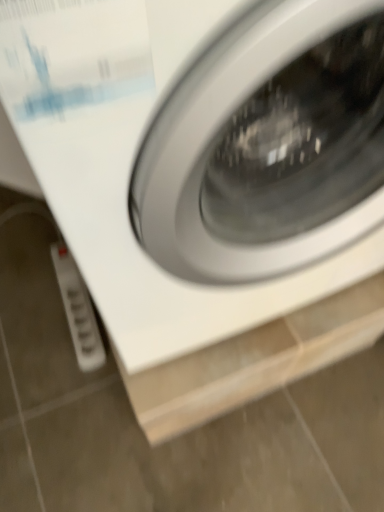
Question: Should I look upward or downward to see white glossy washing machine at center?

Choices:
 (A) up
 (B) down

Answer: (A)

Question: Is white plastic power strip at lower left looking in the opposite direction of white glossy washing machine at center?

Choices:
 (A) no
 (B) yes

Answer: (A)

Question: Is white plastic power strip at lower left to the right of white glossy washing machine at center from the viewer's perspective?

Choices:
 (A) no
 (B) yes

Answer: (A)

Question: Can you confirm if white plastic power strip at lower left is shorter than white glossy washing machine at center?

Choices:
 (A) no
 (B) yes

Answer: (B)

Question: Is white plastic power strip at lower left not inside white glossy washing machine at center?

Choices:
 (A) no
 (B) yes

Answer: (B)

Question: Can you confirm if white plastic power strip at lower left is smaller than white glossy washing machine at center?

Choices:
 (A) yes
 (B) no

Answer: (A)

Question: Is white plastic power strip at lower left further to camera compared to white glossy washing machine at center?

Choices:
 (A) yes
 (B) no

Answer: (A)

Question: Can you confirm if white glossy washing machine at center is smaller than white plastic power strip at lower left?

Choices:
 (A) yes
 (B) no

Answer: (B)

Question: Is white plastic power strip at lower left inside white glossy washing machine at center?

Choices:
 (A) no
 (B) yes

Answer: (A)

Question: Is white glossy washing machine at center beside white plastic power strip at lower left?

Choices:
 (A) no
 (B) yes

Answer: (A)

Question: Does white glossy washing machine at center come in front of white plastic power strip at lower left?

Choices:
 (A) no
 (B) yes

Answer: (B)

Question: Does white glossy washing machine at center have a greater width compared to white plastic power strip at lower left?

Choices:
 (A) yes
 (B) no

Answer: (A)

Question: Can you confirm if white glossy washing machine at center is taller than white plastic power strip at lower left?

Choices:
 (A) no
 (B) yes

Answer: (B)

Question: From the image's perspective, is white glossy washing machine at center positioned above or below white plastic power strip at lower left?

Choices:
 (A) above
 (B) below

Answer: (A)